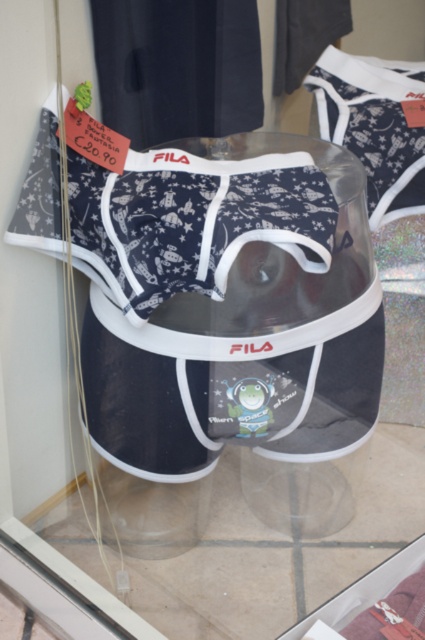
Which is more to the right, navy blue cotton boxer shorts at center or transparent plastic at center?

transparent plastic at center

The image size is (425, 640). What are the coordinates of `navy blue cotton boxer shorts at center` in the screenshot? It's located at (192, 220).